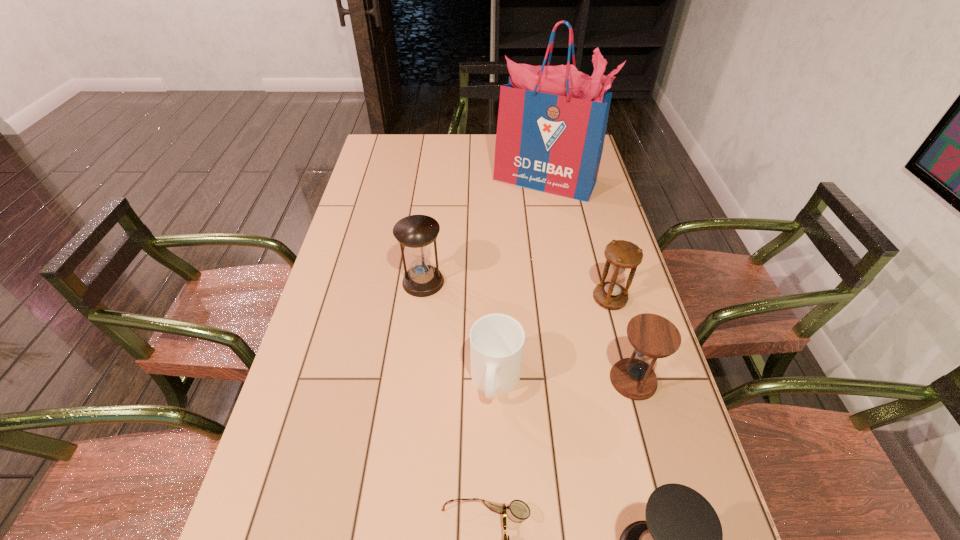
What are the coordinates of `hourglass that is the second closest to the grocery bag` in the screenshot? It's located at (622, 255).

Where is `the third closest hourglass to the nearest hourglass`? Image resolution: width=960 pixels, height=540 pixels. the third closest hourglass to the nearest hourglass is located at coordinates (416, 232).